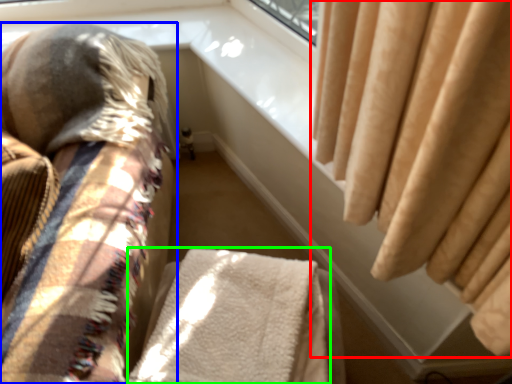
Question: Which object is the farthest from curtain (highlighted by a red box)? Choose among these: furniture (highlighted by a blue box) or blanket (highlighted by a green box).

Choices:
 (A) furniture
 (B) blanket

Answer: (A)